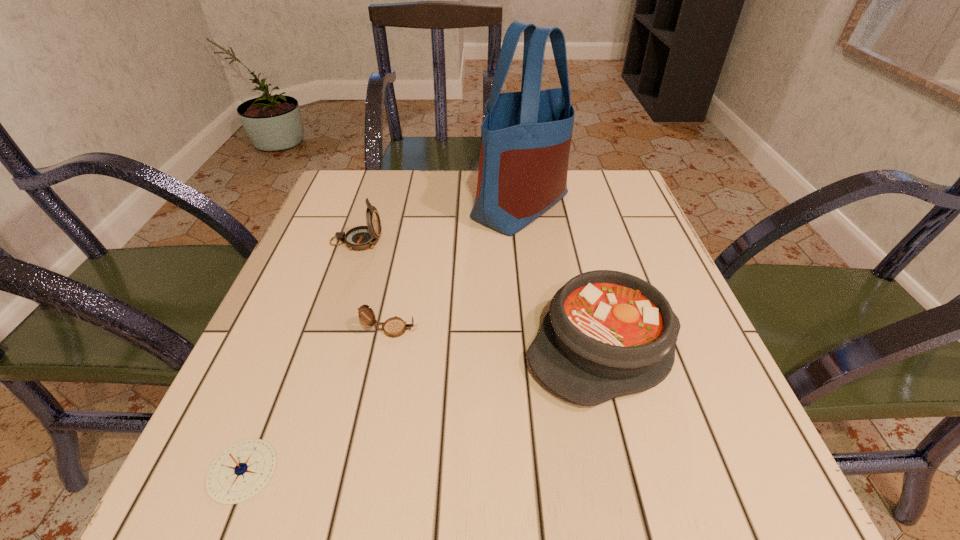
Identify the location of vacant space at the right edge of the desktop. The width and height of the screenshot is (960, 540). (672, 381).

The height and width of the screenshot is (540, 960). I want to click on vacant space at the far left corner, so click(351, 181).

Locate an element on the screen. This screenshot has width=960, height=540. free point at the near right corner is located at coordinates (722, 451).

At what (x,y) coordinates should I click in order to perform the action: click on free space between the tallest object and the nearest compass. Please return your answer as a coordinate pair (x, y). The width and height of the screenshot is (960, 540). Looking at the image, I should click on (382, 338).

Locate an element on the screen. The height and width of the screenshot is (540, 960). free space between the nearest compass and the casserole is located at coordinates pos(423,409).

Identify the location of empty location between the handbag and the casserole. This screenshot has height=540, width=960. (563, 275).

Image resolution: width=960 pixels, height=540 pixels. Find the location of `vacant space in between the casserole and the nearest object`. vacant space in between the casserole and the nearest object is located at coordinates (423, 409).

You are a GUI agent. You are given a task and a screenshot of the screen. Output one action in this format:
    pyautogui.click(x=<x>, y=<y>)
    Task: Click on the free spot between the second farthest compass and the nearest object
    The image size is (960, 540).
    Given the screenshot: What is the action you would take?
    pyautogui.click(x=317, y=400)

Locate an element on the screen. The height and width of the screenshot is (540, 960). free space between the casserole and the tallest compass is located at coordinates (480, 294).

Locate an element on the screen. This screenshot has height=540, width=960. free spot between the handbag and the second nearest compass is located at coordinates (456, 267).